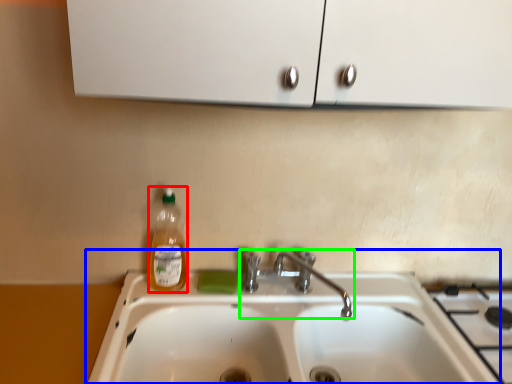
Question: Considering the real-world distances, which object is closest to bottle (highlighted by a red box)? sink (highlighted by a blue box) or tap (highlighted by a green box).

Choices:
 (A) sink
 (B) tap

Answer: (B)